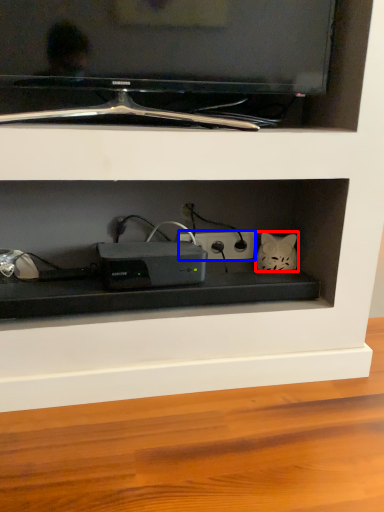
Question: Which of the following is the closest to the observer, cat (highlighted by a red box) or electric outlet (highlighted by a blue box)?

Choices:
 (A) cat
 (B) electric outlet

Answer: (A)